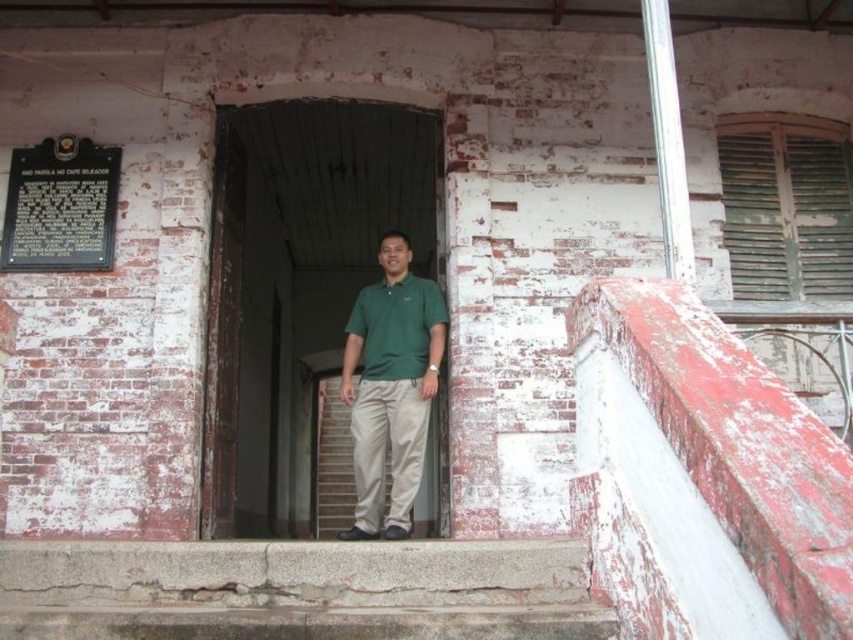
Between green matte shirt at center and black metal plaque at upper left, which one has less height?

black metal plaque at upper left is shorter.

Does point (380, 484) come farther from viewer compared to point (57, 220)?

No, it is not.

Where is `green matte shirt at center`? green matte shirt at center is located at coordinates (392, 387).

Who is more forward, [392,330] or [405,278]?

Point [392,330] is more forward.

Is point (415, 404) farther from viewer compared to point (363, 355)?

No, (415, 404) is in front of (363, 355).

At what (x,y) coordinates should I click in order to perform the action: click on green matte shirt at center. Please return your answer as a coordinate pair (x, y). This screenshot has height=640, width=853. Looking at the image, I should click on (392, 387).

Does point (369, 240) come in front of point (375, 316)?

That is False.

Consider the image. Does wooden door at center have a lesser height compared to green cotton polo shirt at center?

Incorrect, wooden door at center's height does not fall short of green cotton polo shirt at center's.

Is point (268, 108) positioned before point (372, 304)?

That is False.

Find the location of a particular element. wooden door at center is located at coordinates (300, 264).